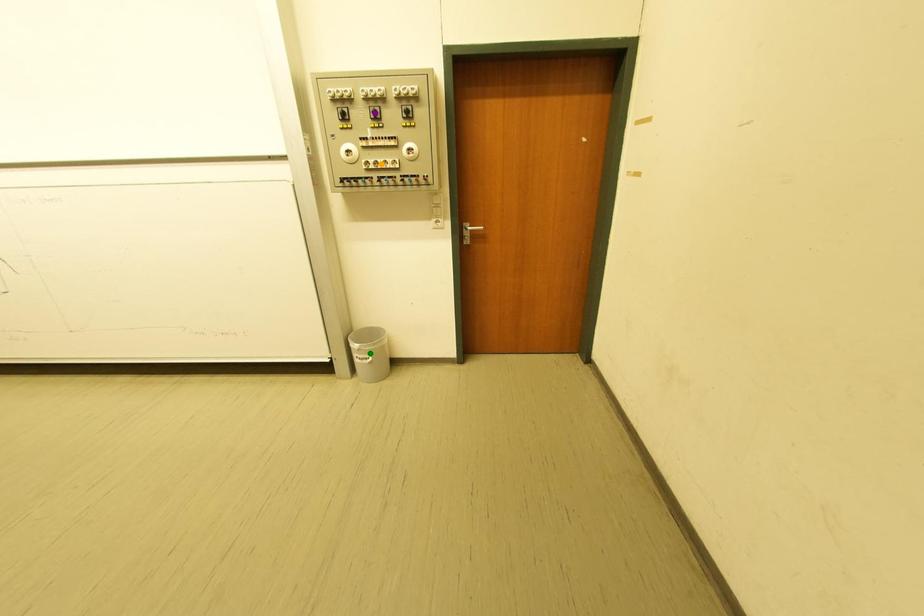
Order these from nearest to farthest:
orange point
purple point
green point

1. purple point
2. orange point
3. green point